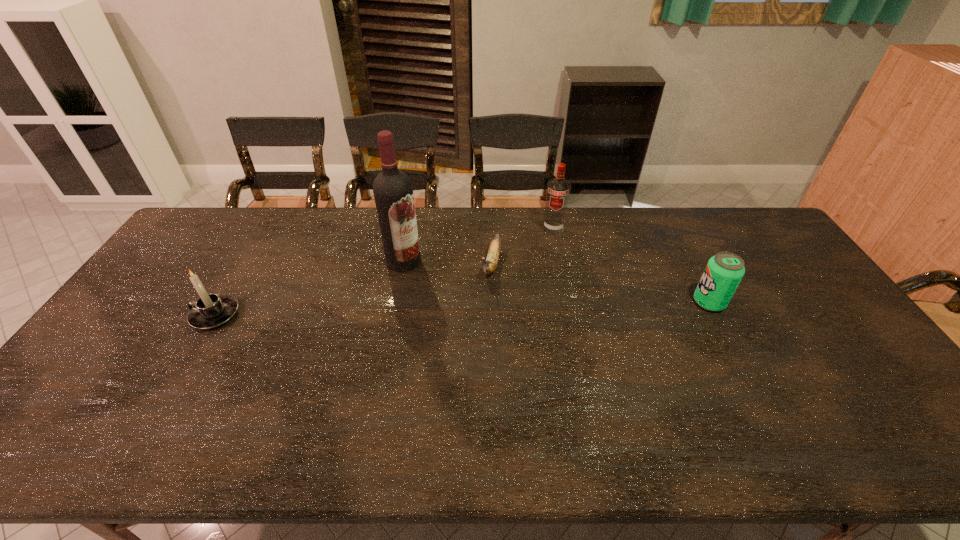
Identify the location of vacant area that lies between the farthest object and the tallest object. This screenshot has height=540, width=960. (478, 245).

The width and height of the screenshot is (960, 540). I want to click on free area in between the shortest object and the candle holder, so (353, 289).

Identify the location of free space between the fourth object from right to left and the rightmost object. (557, 281).

Find the location of a particular element. free space between the rightmost object and the wine bottle is located at coordinates (557, 281).

Locate an element on the screen. Image resolution: width=960 pixels, height=540 pixels. free space between the pop soda and the candle holder is located at coordinates (462, 308).

The height and width of the screenshot is (540, 960). In order to click on empty location between the shortest object and the pop soda in this screenshot , I will do `click(600, 283)`.

Identify the location of vacant space that is in between the pop soda and the fourth shortest object. The height and width of the screenshot is (540, 960). [x=631, y=265].

Locate an element on the screen. The width and height of the screenshot is (960, 540). vacant space that's between the fourth object from left to right and the wine bottle is located at coordinates (478, 245).

Where is `the third closest object to the rightmost object`? the third closest object to the rightmost object is located at coordinates (393, 192).

Where is `object that ranks as the second closest to the second tallest object`? object that ranks as the second closest to the second tallest object is located at coordinates (393, 192).